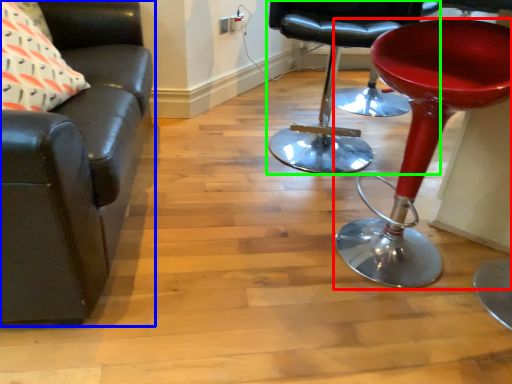
Question: Considering the real-world distances, which object is farthest from stool (highlighted by a red box)? chair (highlighted by a blue box) or chair (highlighted by a green box)?

Choices:
 (A) chair
 (B) chair

Answer: (A)